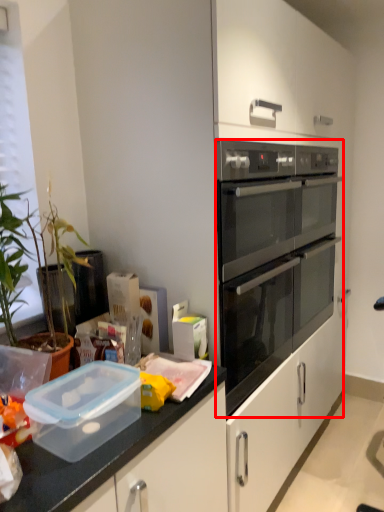
Question: From the image's perspective, what is the correct spatial relationship of oven (annotated by the red box) in relation to appliance?

Choices:
 (A) below
 (B) above

Answer: (B)